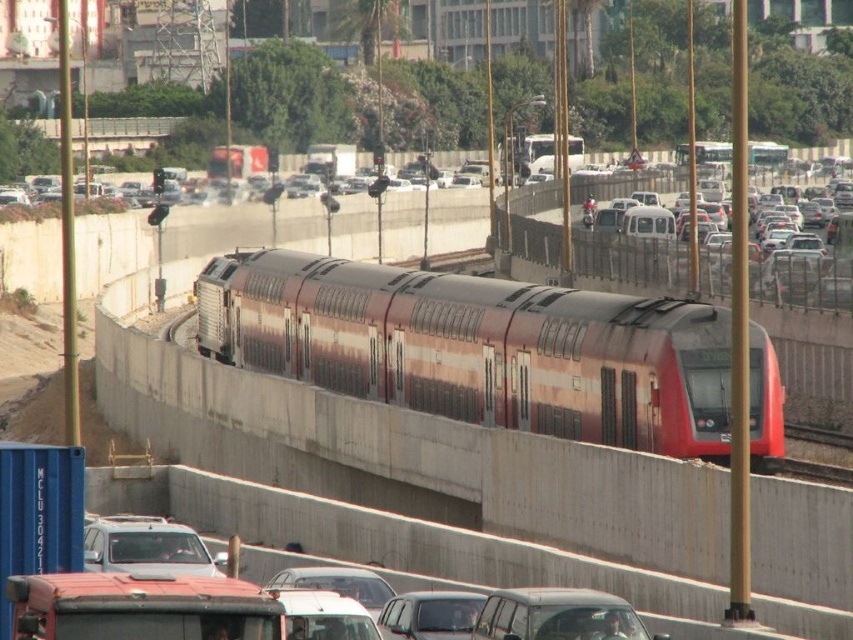
Question: Which object is the farthest from the metallic silver van at center?

Choices:
 (A) silver metallic car at lower left
 (B) metallic silver car at center

Answer: (A)

Question: Is metallic red train at center smaller than metallic silver car at center?

Choices:
 (A) yes
 (B) no

Answer: (B)

Question: Which point appears farthest from the camera in this image?

Choices:
 (A) (141, 515)
 (B) (581, 368)
 (C) (538, 616)
 (D) (402, 604)

Answer: (A)

Question: Which is farther from the silver metallic car at lower left?

Choices:
 (A) metallic silver van at center
 (B) metallic silver car at center
 (C) metallic red train at center

Answer: (C)

Question: Is metallic red train at center above silver metallic car at lower left?

Choices:
 (A) no
 (B) yes

Answer: (B)

Question: Where is metallic red train at center located in relation to metallic silver car at center in the image?

Choices:
 (A) above
 (B) below

Answer: (A)